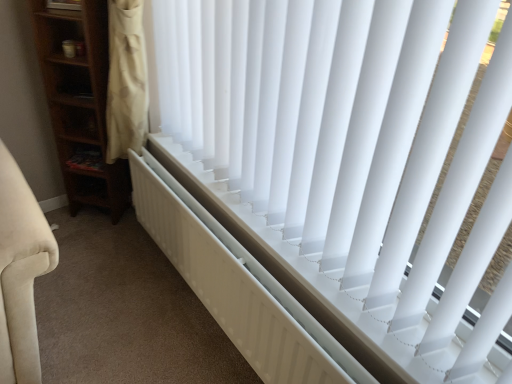
Question: In terms of height, does wooden shelf at left look taller or shorter compared to white plastic blinds at center?

Choices:
 (A) tall
 (B) short

Answer: (B)

Question: From the image's perspective, relative to white plastic blinds at center, is wooden shelf at left above or below?

Choices:
 (A) below
 (B) above

Answer: (A)

Question: Which is farther from the wooden shelf at left?

Choices:
 (A) white plastic blinds at center
 (B) white matte radiator at center

Answer: (A)

Question: Considering the real-world distances, which object is farthest from the white plastic blinds at center?

Choices:
 (A) white matte radiator at center
 (B) wooden shelf at left

Answer: (B)